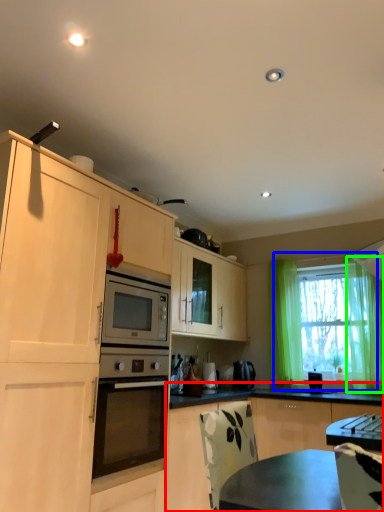
Question: Considering the real-world distances, which object is farthest from cabinetry (highlighted by a red box)? window (highlighted by a blue box) or curtain (highlighted by a green box)?

Choices:
 (A) window
 (B) curtain

Answer: (B)